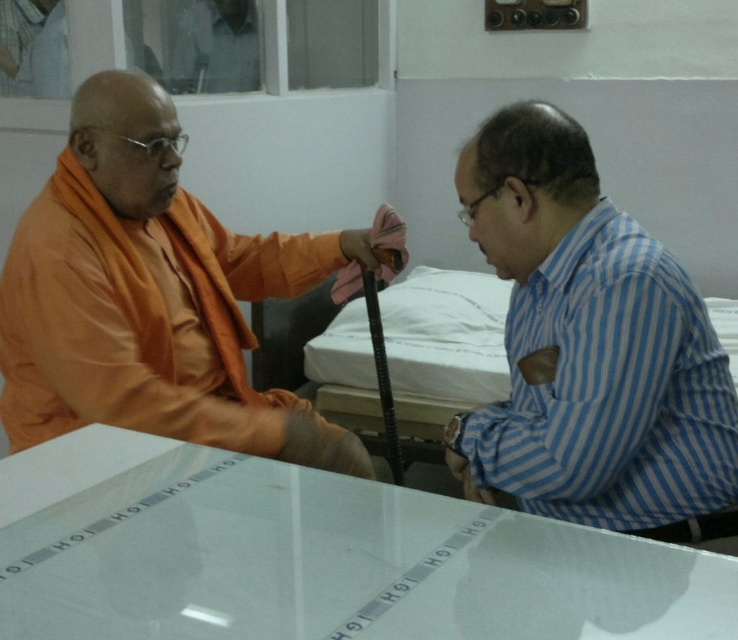
Looking at this image, between orange silk monk at left and blue striped shirt at right, which one is positioned higher?

orange silk monk at left

From the picture: Can you confirm if orange silk monk at left is bigger than blue striped shirt at right?

Yes, orange silk monk at left is bigger than blue striped shirt at right.

Between point (213, 333) and point (506, 138), which one is positioned in front?

Point (506, 138)

Where is `orange silk monk at left`? orange silk monk at left is located at coordinates (155, 296).

Between point (401, 605) and point (266, 272), which one is positioned in front?

Point (401, 605) is more forward.

Is transparent glass table at center thinner than orange silk monk at left?

No.

Who is more forward, (372, 500) or (41, 420)?

Point (372, 500) is more forward.

Image resolution: width=738 pixels, height=640 pixels. I want to click on transparent glass table at center, so click(x=314, y=556).

Which is more to the right, transparent glass table at center or blue striped shirt at right?

Positioned to the right is blue striped shirt at right.

Who is more forward, (127, 564) or (714, 355)?

Point (127, 564)

This screenshot has width=738, height=640. What do you see at coordinates (314, 556) in the screenshot? I see `transparent glass table at center` at bounding box center [314, 556].

The height and width of the screenshot is (640, 738). Identify the location of transparent glass table at center. (314, 556).